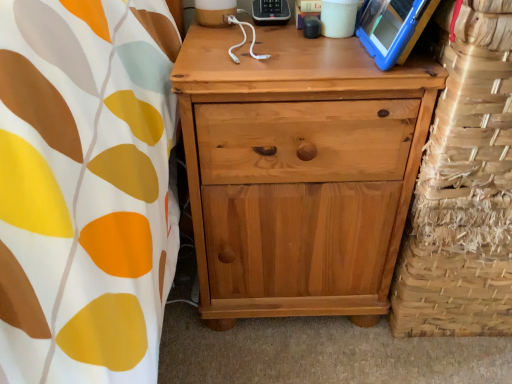
Find the location of a particular element. woven straw basket at right is located at coordinates point(464,190).

Measure the distance between woven straw basket at right and camera.

53.33 centimeters.

Describe the element at coordinates (464, 190) in the screenshot. I see `woven straw basket at right` at that location.

What is the approximate height of natural wood chest of drawers at center?

natural wood chest of drawers at center is 22.74 inches in height.

Where is `natural wood chest of drawers at center`? The image size is (512, 384). natural wood chest of drawers at center is located at coordinates click(298, 172).

This screenshot has width=512, height=384. What do you see at coordinates (298, 172) in the screenshot?
I see `natural wood chest of drawers at center` at bounding box center [298, 172].

Find the location of `woven straw basket at right`. woven straw basket at right is located at coordinates click(464, 190).

Considering the positions of objects natural wood chest of drawers at center and woven straw basket at right in the image provided, who is more to the right, natural wood chest of drawers at center or woven straw basket at right?

woven straw basket at right is more to the right.

Is natural wood chest of drawers at center in front of woven straw basket at right?

No, it is behind woven straw basket at right.

Considering the positions of points (250, 274) and (449, 124), is point (250, 274) closer to camera compared to point (449, 124)?

No, it is behind (449, 124).

From the image's perspective, which is above, natural wood chest of drawers at center or woven straw basket at right?

woven straw basket at right, from the image's perspective.

Consider the image. From a real-world perspective, between natural wood chest of drawers at center and woven straw basket at right, who is vertically lower?

A: In real-world perspective, natural wood chest of drawers at center is lower.

Considering the relative sizes of natural wood chest of drawers at center and woven straw basket at right in the image provided, is natural wood chest of drawers at center thinner than woven straw basket at right?

No, natural wood chest of drawers at center is not thinner than woven straw basket at right.

Which of these two, natural wood chest of drawers at center or woven straw basket at right, stands shorter?

With less height is woven straw basket at right.

Looking at the image, does natural wood chest of drawers at center seem bigger or smaller compared to woven straw basket at right?

Clearly, natural wood chest of drawers at center is larger in size than woven straw basket at right.

Is natural wood chest of drawers at center situated inside woven straw basket at right or outside?

The correct answer is: outside.

Looking at this image, is natural wood chest of drawers at center in contact with woven straw basket at right?

No, natural wood chest of drawers at center is not touching woven straw basket at right.

Is natural wood chest of drawers at center positioned with its back to woven straw basket at right?

No, woven straw basket at right is not at the back of natural wood chest of drawers at center.

How distant is natural wood chest of drawers at center from woven straw basket at right?

A distance of 6.94 inches exists between natural wood chest of drawers at center and woven straw basket at right.

The width and height of the screenshot is (512, 384). Find the location of `basket lying in front of the natural wood chest of drawers at center`. basket lying in front of the natural wood chest of drawers at center is located at coordinates (464, 190).

Considering the positions of objects woven straw basket at right and natural wood chest of drawers at center in the image provided, who is more to the left, woven straw basket at right or natural wood chest of drawers at center?

Positioned to the left is natural wood chest of drawers at center.

Is woven straw basket at right in front of or behind natural wood chest of drawers at center in the image?

woven straw basket at right is in front of natural wood chest of drawers at center.

Does point (511, 119) appear closer or farther from the camera than point (241, 283)?

Point (511, 119).

From the image's perspective, is woven straw basket at right located above or below natural wood chest of drawers at center?

Clearly, from the image's perspective, woven straw basket at right is above natural wood chest of drawers at center.

From a real-world perspective, who is located lower, woven straw basket at right or natural wood chest of drawers at center?

natural wood chest of drawers at center is physically lower.

Is woven straw basket at right wider or thinner than natural wood chest of drawers at center?

In the image, woven straw basket at right appears to be more narrow than natural wood chest of drawers at center.

Is woven straw basket at right taller or shorter than natural wood chest of drawers at center?

woven straw basket at right is shorter than natural wood chest of drawers at center.

Which of these two, woven straw basket at right or natural wood chest of drawers at center, is bigger?

natural wood chest of drawers at center is bigger.

Is woven straw basket at right situated inside natural wood chest of drawers at center or outside?

woven straw basket at right is not inside natural wood chest of drawers at center, it's outside.

Are woven straw basket at right and natural wood chest of drawers at center far apart?

They are positioned close to each other.

Is woven straw basket at right looking in the opposite direction of natural wood chest of drawers at center?

No, woven straw basket at right is not facing away from natural wood chest of drawers at center.

Can you tell me how much woven straw basket at right and natural wood chest of drawers at center differ in facing direction?

The facing directions of woven straw basket at right and natural wood chest of drawers at center are 0.000262 degrees apart.

At what (x,y) coordinates should I click in order to perform the action: click on basket on the right of natural wood chest of drawers at center. Please return your answer as a coordinate pair (x, y). The height and width of the screenshot is (384, 512). Looking at the image, I should click on coord(464,190).

Where is `the chest of drawers behind the woven straw basket at right`? The width and height of the screenshot is (512, 384). the chest of drawers behind the woven straw basket at right is located at coordinates (298, 172).

The height and width of the screenshot is (384, 512). Find the location of `basket that is on the right side of natural wood chest of drawers at center`. basket that is on the right side of natural wood chest of drawers at center is located at coordinates (464, 190).